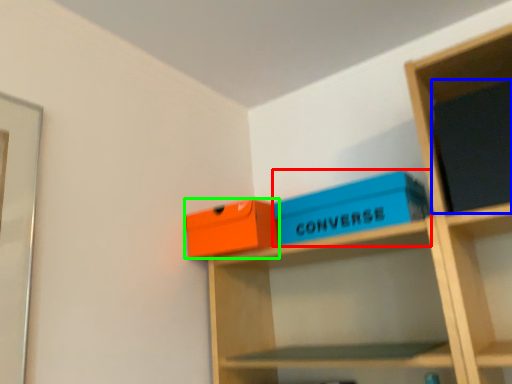
Question: Considering the real-world distances, which object is closest to box (highlighted by a red box)? paperback book (highlighted by a blue box) or box (highlighted by a green box).

Choices:
 (A) paperback book
 (B) box

Answer: (B)